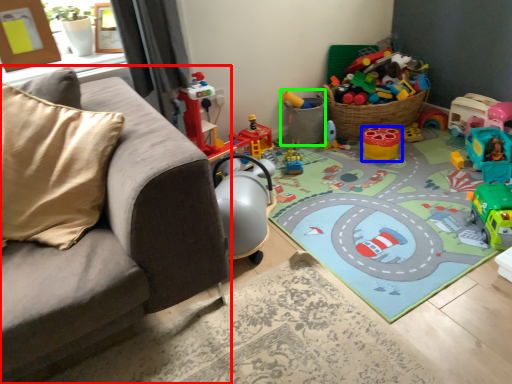
Question: Estimate the real-world distances between objects in this image. Which object is farther from studio couch (highlighted by a red box), toy (highlighted by a blue box) or toy (highlighted by a green box)?

Choices:
 (A) toy
 (B) toy

Answer: (A)